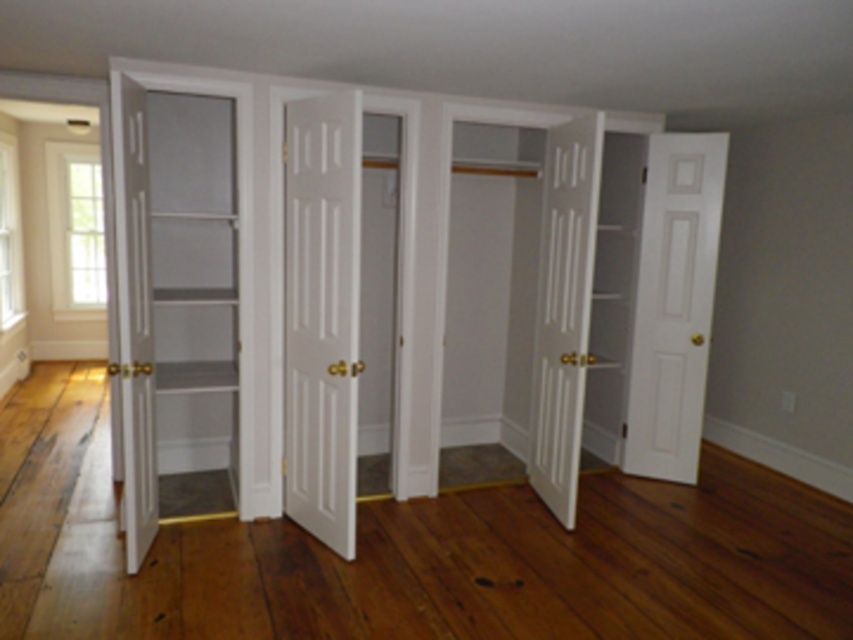
You are organizing a furniture inventory in a room. You have two doors to measure for a report. The white matte closet doors at center and the white glossy door at left. Which door should you note as having a bigger size in your report?

The white matte closet doors at center has a larger size compared to the white glossy door at left, so you should note the white matte closet doors at center as the bigger one in your report.

Consider the image. You are standing in the room and want to open the closest door between the white smooth door at center and the white glossy door at left. Which door should you choose?

The white smooth door at center is closer to you, so you should choose it to open the closest door.

You are standing in the room and see the point at coordinates (322, 314). Based on the scene description, which object does this point belong to?

The point at coordinates (322, 314) is on the white smooth door at center.